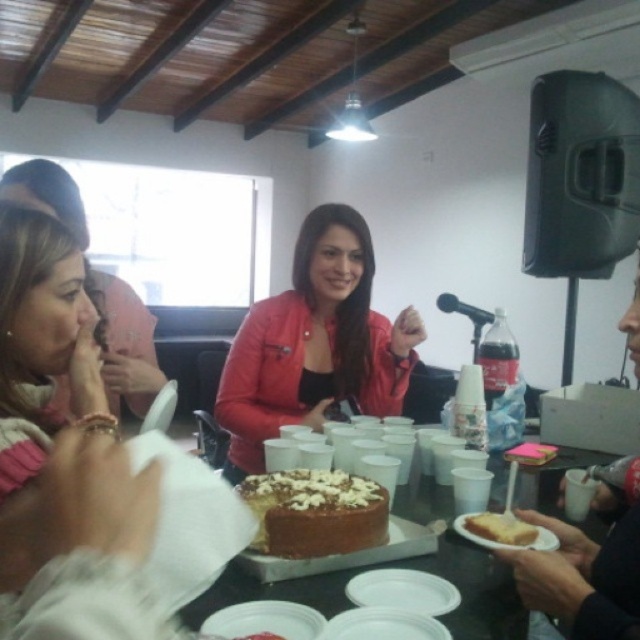
Find the location of `chocolate frosted cake at center`. chocolate frosted cake at center is located at coordinates (316, 513).

Who is more distant from viewer, [337,545] or [516,525]?

Positioned behind is point [516,525].

You are a GUI agent. You are given a task and a screenshot of the screen. Output one action in this format:
    pyautogui.click(x=<x>, y=<y>)
    Task: Click on the chocolate frosted cake at center
    This screenshot has height=640, width=640.
    Given the screenshot: What is the action you would take?
    pyautogui.click(x=316, y=513)

Does matte red jacket at center have a larger size compared to black plastic microphone at upper right?

Indeed, matte red jacket at center has a larger size compared to black plastic microphone at upper right.

Who is positioned more to the left, matte red jacket at center or black plastic microphone at upper right?

Positioned to the left is matte red jacket at center.

Which is behind, point (284, 342) or point (445, 300)?

The point (445, 300) is more distant.

Locate an element on the screen. matte red jacket at center is located at coordinates (314, 344).

Which is above, matte pink scarf at left or chocolate frosted cake at center?

matte pink scarf at left

What do you see at coordinates (42, 339) in the screenshot? This screenshot has height=640, width=640. I see `matte pink scarf at left` at bounding box center [42, 339].

Find the location of a particular element. The height and width of the screenshot is (640, 640). matte pink scarf at left is located at coordinates (42, 339).